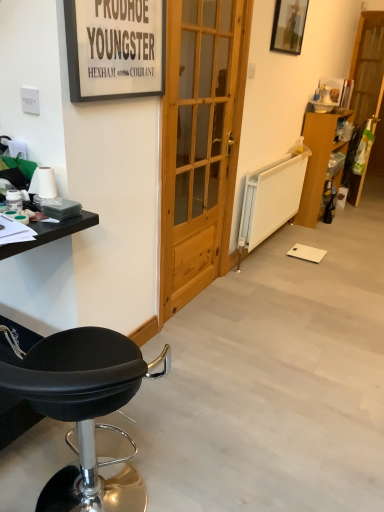
Question: Does matte black picture frame at upper left, marked as the first picture frame in a bottom-to-top arrangement, have a greater width compared to black matte table at left?

Choices:
 (A) yes
 (B) no

Answer: (B)

Question: Would you say black matte table at left is part of matte black picture frame at upper left, positioned as the second picture frame in top-to-bottom order,'s contents?

Choices:
 (A) no
 (B) yes

Answer: (A)

Question: From the image's perspective, is matte black picture frame at upper left, marked as the first picture frame in a bottom-to-top arrangement, on top of black matte table at left?

Choices:
 (A) yes
 (B) no

Answer: (A)

Question: Considering the relative sizes of matte black picture frame at upper left, the second picture frame in the back-to-front sequence, and black matte table at left in the image provided, is matte black picture frame at upper left, the second picture frame in the back-to-front sequence, bigger than black matte table at left?

Choices:
 (A) no
 (B) yes

Answer: (A)

Question: From a real-world perspective, is matte black picture frame at upper left, marked as the first picture frame in a bottom-to-top arrangement, located higher than black matte table at left?

Choices:
 (A) no
 (B) yes

Answer: (B)

Question: Considering the relative positions of matte black picture frame at upper left, the 2th picture frame viewed from the right, and black matte table at left in the image provided, is matte black picture frame at upper left, the 2th picture frame viewed from the right, to the right of black matte table at left from the viewer's perspective?

Choices:
 (A) no
 (B) yes

Answer: (B)

Question: Is wooden cabinet at right in contact with matte black picture frame at upper left, positioned as the second picture frame in top-to-bottom order?

Choices:
 (A) no
 (B) yes

Answer: (A)

Question: Does wooden cabinet at right have a lesser width compared to matte black picture frame at upper left, marked as the first picture frame in a left-to-right arrangement?

Choices:
 (A) yes
 (B) no

Answer: (B)

Question: From the image's perspective, is wooden cabinet at right below matte black picture frame at upper left, marked as the first picture frame in a left-to-right arrangement?

Choices:
 (A) no
 (B) yes

Answer: (A)

Question: Is wooden cabinet at right shorter than matte black picture frame at upper left, marked as the first picture frame in a bottom-to-top arrangement?

Choices:
 (A) yes
 (B) no

Answer: (B)

Question: Would you say wooden cabinet at right is outside matte black picture frame at upper left, marked as the first picture frame in a left-to-right arrangement?

Choices:
 (A) yes
 (B) no

Answer: (A)

Question: Does wooden cabinet at right have a larger size compared to matte black picture frame at upper left, the 2th picture frame viewed from the right?

Choices:
 (A) yes
 (B) no

Answer: (A)

Question: From a real-world perspective, is wooden picture frame at upper right, positioned as the first picture frame in top-to-bottom order, physically above natural wood door at center?

Choices:
 (A) no
 (B) yes

Answer: (B)